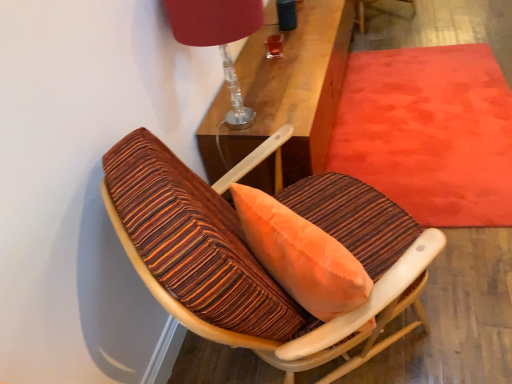
Question: Considering the relative sizes of velvet red mat at upper right and matte red lampshade at upper center in the image provided, is velvet red mat at upper right shorter than matte red lampshade at upper center?

Choices:
 (A) no
 (B) yes

Answer: (B)

Question: Is velvet red mat at upper right outside matte red lampshade at upper center?

Choices:
 (A) no
 (B) yes

Answer: (B)

Question: Does velvet red mat at upper right come behind matte red lampshade at upper center?

Choices:
 (A) no
 (B) yes

Answer: (B)

Question: Does velvet red mat at upper right appear on the left side of matte red lampshade at upper center?

Choices:
 (A) yes
 (B) no

Answer: (B)

Question: Is velvet red mat at upper right positioned far away from matte red lampshade at upper center?

Choices:
 (A) yes
 (B) no

Answer: (A)

Question: Looking at their shapes, would you say matte red lampshade at upper center is wider or thinner than wooden textured chair at center?

Choices:
 (A) wide
 (B) thin

Answer: (B)

Question: Is matte red lampshade at upper center inside or outside of wooden textured chair at center?

Choices:
 (A) outside
 (B) inside

Answer: (A)

Question: From the image's perspective, is matte red lampshade at upper center above or below wooden textured chair at center?

Choices:
 (A) above
 (B) below

Answer: (A)

Question: Considering the positions of point pos(224,69) and point pos(121,148), is point pos(224,69) closer or farther from the camera than point pos(121,148)?

Choices:
 (A) closer
 (B) farther

Answer: (B)

Question: Does point (455, 104) appear closer or farther from the camera than point (138, 175)?

Choices:
 (A) farther
 (B) closer

Answer: (A)

Question: Considering the positions of velvet red mat at upper right and wooden textured chair at center in the image, is velvet red mat at upper right taller or shorter than wooden textured chair at center?

Choices:
 (A) short
 (B) tall

Answer: (A)

Question: Would you say velvet red mat at upper right is inside or outside wooden textured chair at center?

Choices:
 (A) inside
 (B) outside

Answer: (B)

Question: Considering the positions of velvet red mat at upper right and wooden textured chair at center in the image, is velvet red mat at upper right wider or thinner than wooden textured chair at center?

Choices:
 (A) wide
 (B) thin

Answer: (A)

Question: Choose the correct answer: Is velvet red mat at upper right inside matte red lampshade at upper center or outside it?

Choices:
 (A) outside
 (B) inside

Answer: (A)

Question: From a real-world perspective, is velvet red mat at upper right physically located above or below matte red lampshade at upper center?

Choices:
 (A) above
 (B) below

Answer: (B)